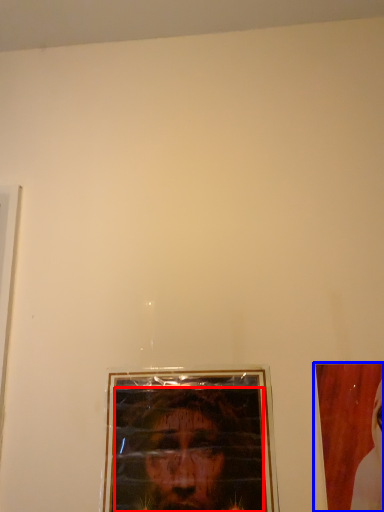
Question: Which of the following is the closest to the observer, man (highlighted by a red box) or picture frame (highlighted by a blue box)?

Choices:
 (A) man
 (B) picture frame

Answer: (B)